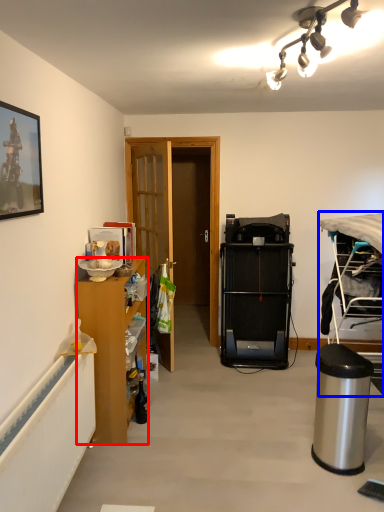
Question: Which of the following is the closest to the observer, cabinetry (highlighted by a red box) or desk (highlighted by a blue box)?

Choices:
 (A) cabinetry
 (B) desk

Answer: (B)